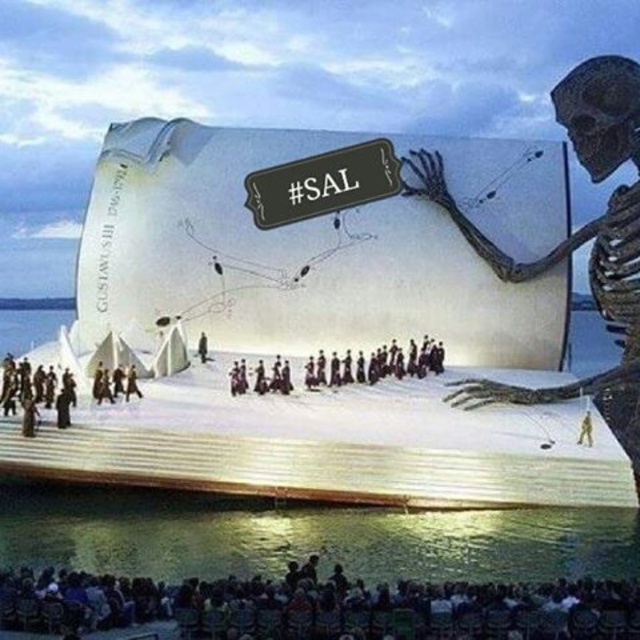
You are standing at the point closest to the skeletal figure on the shipwreck. Which point, point (339, 531) or point (401, 355), is closer to you?

Point (339, 531) is in front of point (401, 355), so it is closer to you.

You are a stagehand measuring the distance between the clear water at stage bottom and the dark brown uniform at center for a new lighting setup. The minimum distance required for the lights to function properly is 20 meters. Can the current setup accommodate the lights?

The clear water at stage bottom and dark brown uniform at center are 19.68 meters apart, which is less than the required 20 meters. The current setup cannot accommodate the lights.